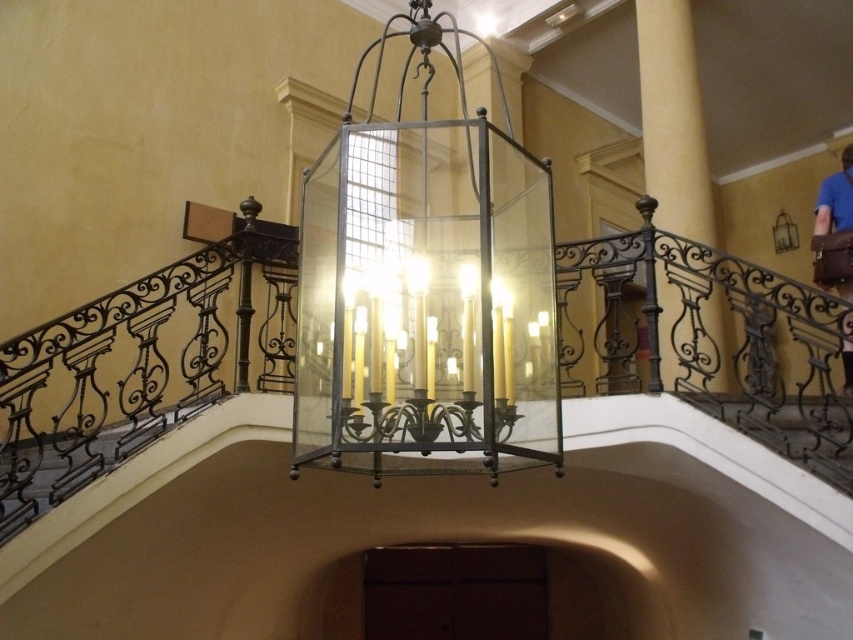
Question: Which point appears closest to the camera in this image?

Choices:
 (A) (718, 346)
 (B) (549, 436)
 (C) (3, 464)

Answer: (B)

Question: From the image, what is the correct spatial relationship of yellow matte column at upper right in relation to blue leather bag at right?

Choices:
 (A) left
 (B) right

Answer: (A)

Question: From the image, what is the correct spatial relationship of clear glass lantern at center in relation to wrought iron railing at left?

Choices:
 (A) right
 (B) left

Answer: (A)

Question: Does metallic wrought iron at lower right appear under blue leather bag at right?

Choices:
 (A) yes
 (B) no

Answer: (A)

Question: Which point appears farthest from the camera in this image?

Choices:
 (A) (714, 394)
 (B) (350, 454)
 (C) (84, 476)

Answer: (A)

Question: Among these points, which one is nearest to the camera?

Choices:
 (A) (660, 195)
 (B) (840, 433)
 (C) (126, 445)

Answer: (C)